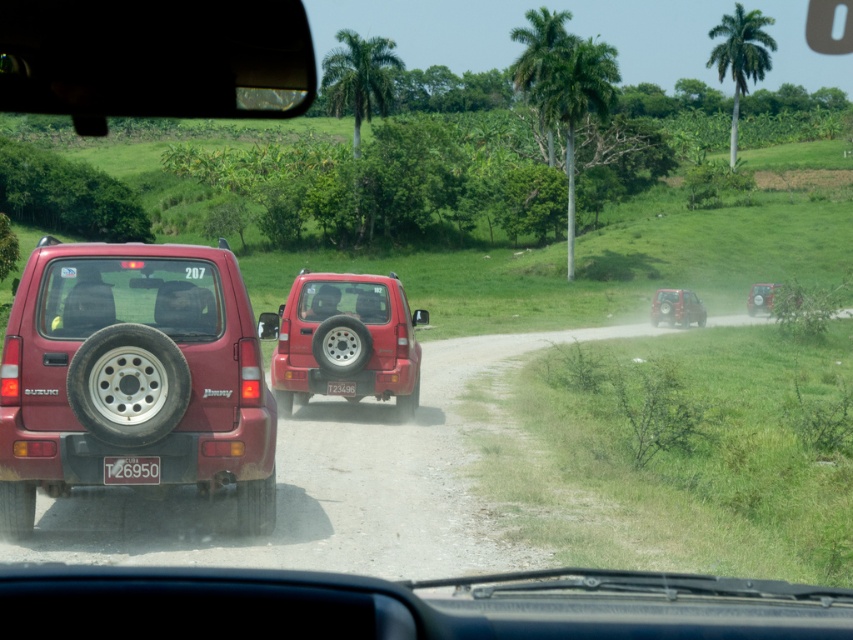
Looking at this image, you are driving a car and see two matte red suv at center. Which one is closer to you?

The matte red suv at center with license plate T26950 is closer to you since it is only 15.79 meters away from the other matte red suv at center with license plate T23496.

You are driving a car and want to check the license plate number of the vehicle in front of you. The license plate is located at point (131, 468). Can you see it clearly from your current position?

The white plastic license plate at rear center is represented by point (131, 468). Since you are in a vehicle and the license plate is on the rear of the vehicle in front, you should be able to see it clearly from your current position as it is positioned at the rear center.